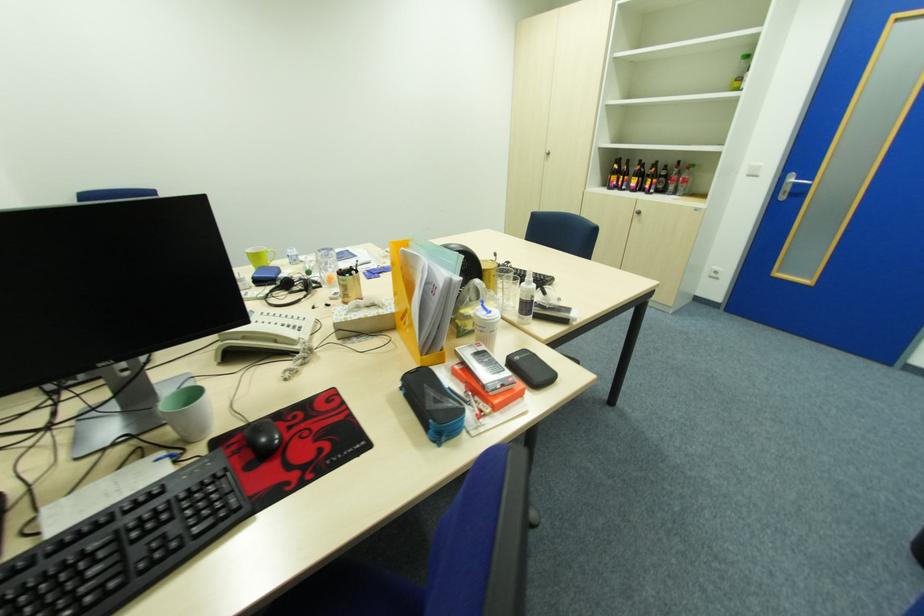
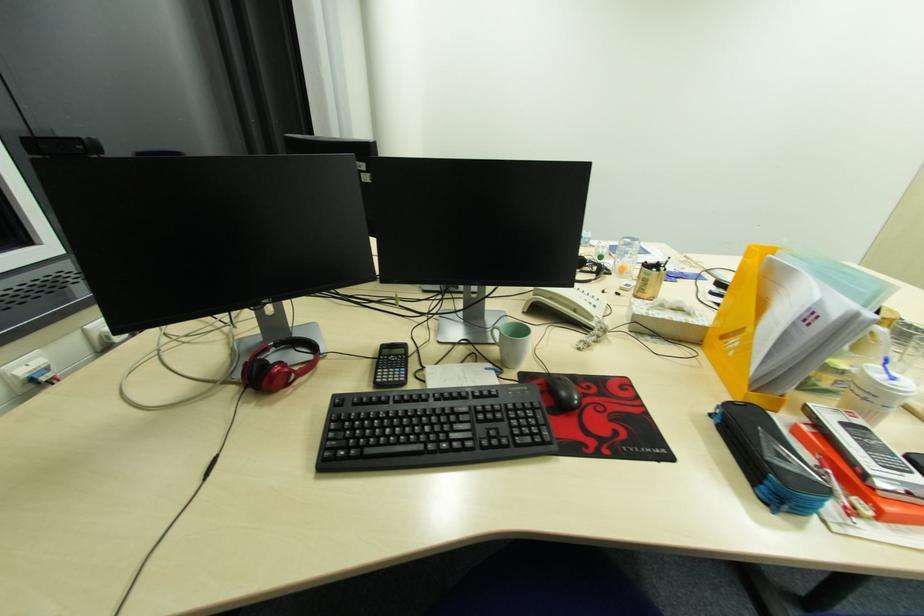
Question: The first image is from the beginning of the video and the second image is from the end. How did the camera likely rotate when shooting the video?

Choices:
 (A) Left
 (B) Right
 (C) Up
 (D) Down

Answer: (A)